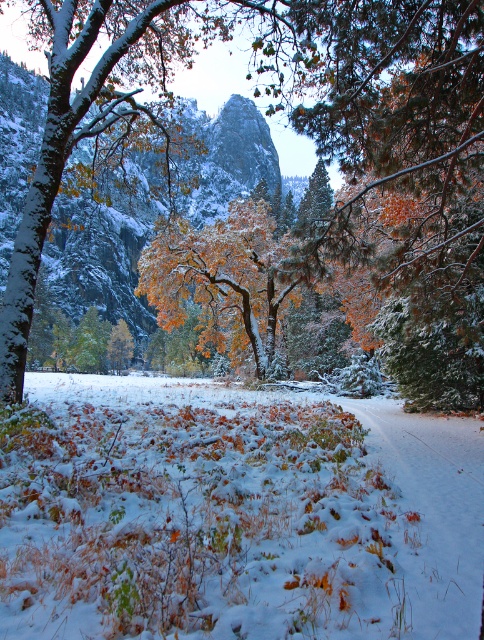
Question: Which of the following is the closest to the observer?

Choices:
 (A) (201, 115)
 (B) (127, 524)
 (C) (459, 72)
 (D) (242, 298)

Answer: (B)

Question: Among these points, which one is nearest to the camera?

Choices:
 (A) (409, 467)
 (B) (148, 218)
 (C) (187, 227)
 (D) (427, 96)

Answer: (D)

Question: Is rocky gray mountain at center wider than golden leafy tree at center?

Choices:
 (A) yes
 (B) no

Answer: (A)

Question: Can you confirm if snow-covered tree at center is wider than golden leafy tree at center?

Choices:
 (A) no
 (B) yes

Answer: (B)

Question: Is the position of snow-covered tree at center less distant than that of rocky gray mountain at center?

Choices:
 (A) yes
 (B) no

Answer: (A)

Question: Among these points, which one is nearest to the camera?

Choices:
 (A) (316, 80)
 (B) (267, 131)
 (C) (270, 324)

Answer: (A)